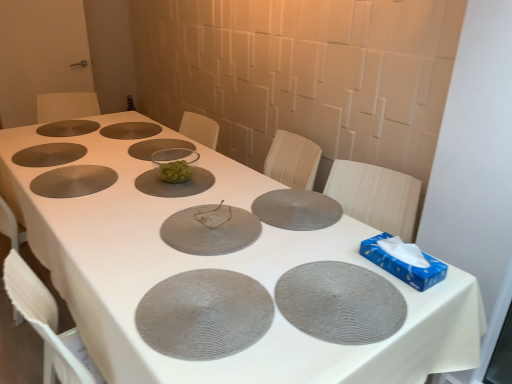
Locate an element on the screen. vacant area that is in front of matte gray placemat at center, which ranks as the 4th glass plate in front-to-back order is located at coordinates (300, 243).